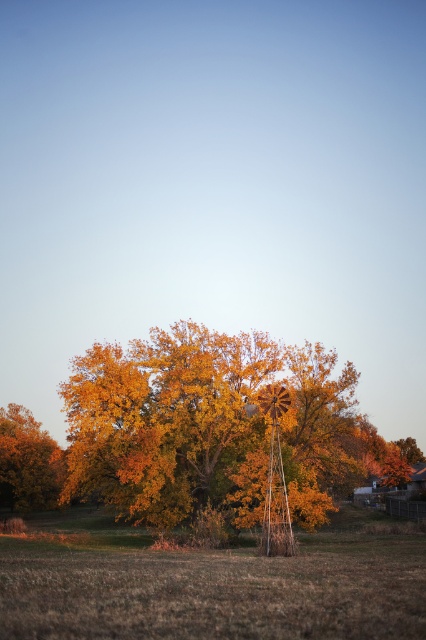
Where is `golden wood tree at center`? golden wood tree at center is located at coordinates (195, 432).

Is point (301, 419) farther from viewer compared to point (391, 576)?

Yes, point (301, 419) is behind point (391, 576).

The height and width of the screenshot is (640, 426). I want to click on golden wood tree at center, so click(x=195, y=432).

Consider the image. Does golden wood tree at center have a lesser width compared to golden textured tree at lower left?

In fact, golden wood tree at center might be wider than golden textured tree at lower left.

Which is in front, point (95, 368) or point (46, 460)?

Point (95, 368) is more forward.

Identify the location of golden wood tree at center. The height and width of the screenshot is (640, 426). (195, 432).

Does brown grass at center appear on the left side of golden textured tree at lower left?

Incorrect, brown grass at center is not on the left side of golden textured tree at lower left.

Which is more to the left, brown grass at center or golden textured tree at lower left?

golden textured tree at lower left

Find the location of a particular element. The image size is (426, 640). brown grass at center is located at coordinates (212, 582).

I want to click on brown grass at center, so click(212, 582).